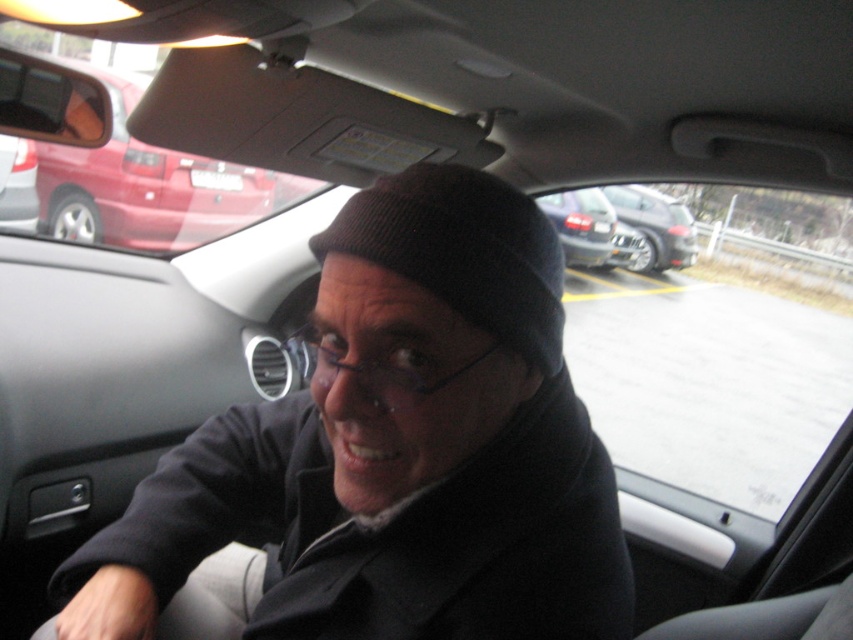
Question: Among these objects, which one is farthest from the camera?

Choices:
 (A) black knit cap at center
 (B) black knit beanie at center
 (C) satin black sedan at center

Answer: (C)

Question: Does black knit beanie at center have a larger size compared to satin black sedan at center?

Choices:
 (A) yes
 (B) no

Answer: (B)

Question: Based on their relative distances, which object is farther from the black knit cap at center?

Choices:
 (A) satin black sedan at center
 (B) metallic silver suv at center
 (C) black knit beanie at center

Answer: (B)

Question: Which of the following is the closest to the observer?

Choices:
 (A) metallic silver suv at center
 (B) satin black sedan at center
 (C) black knit cap at center

Answer: (C)

Question: Can you confirm if black knit cap at center is smaller than black knit beanie at center?

Choices:
 (A) yes
 (B) no

Answer: (B)

Question: Observing the image, what is the correct spatial positioning of metallic red van at upper left in reference to metallic silver suv at center?

Choices:
 (A) right
 (B) left

Answer: (B)